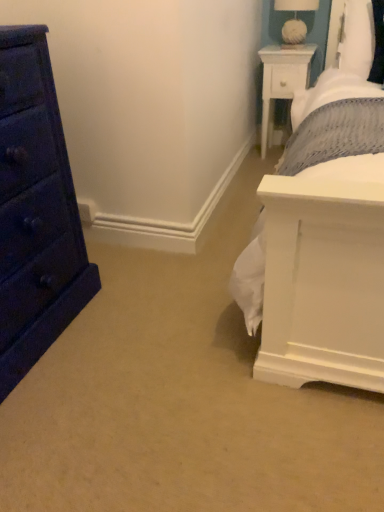
The height and width of the screenshot is (512, 384). Describe the element at coordinates (35, 210) in the screenshot. I see `matte dark blue dresser at left` at that location.

The image size is (384, 512). In order to click on white wood nightstand at upper right in this screenshot , I will do `click(282, 81)`.

Find the location of a particular element. white fabric-covered lampshade at upper right is located at coordinates (x=295, y=19).

Does white wood nightstand at upper right turn towards white fabric-covered lampshade at upper right?

No, white wood nightstand at upper right is not facing towards white fabric-covered lampshade at upper right.

Is white wood nightstand at upper right smaller than white fabric-covered lampshade at upper right?

No.

How distant is white wood nightstand at upper right from white fabric-covered lampshade at upper right?

They are 8.98 inches apart.

Based on the photo, considering the relative positions of white wood nightstand at upper right and white fabric-covered lampshade at upper right in the image provided, is white wood nightstand at upper right to the left or to the right of white fabric-covered lampshade at upper right?

Clearly, white wood nightstand at upper right is on the left of white fabric-covered lampshade at upper right in the image.

From a real-world perspective, is white fabric-covered lampshade at upper right located higher than matte dark blue dresser at left?

Correct, in the physical world, white fabric-covered lampshade at upper right is higher than matte dark blue dresser at left.

The height and width of the screenshot is (512, 384). I want to click on chest of drawers in front of the white fabric-covered lampshade at upper right, so click(x=35, y=210).

Does point (284, 39) lie in front of point (51, 139)?

That is False.

Does white fabric-covered lampshade at upper right come behind matte dark blue dresser at left?

Yes, it is.

How far apart are matte dark blue dresser at left and white wood nightstand at upper right?

They are 5.69 feet apart.

Is matte dark blue dresser at left far from white wood nightstand at upper right?

Yes, matte dark blue dresser at left and white wood nightstand at upper right are quite far apart.

From a real-world perspective, does matte dark blue dresser at left sit lower than white wood nightstand at upper right?

No.

How many degrees apart are the facing directions of matte dark blue dresser at left and white wood nightstand at upper right?

The angle between the facing direction of matte dark blue dresser at left and the facing direction of white wood nightstand at upper right is 88.5 degrees.

Is the depth of matte dark blue dresser at left greater than that of white fabric-covered lampshade at upper right?

No, matte dark blue dresser at left is in front of white fabric-covered lampshade at upper right.

Where is `table lamp lying above the matte dark blue dresser at left (from the image's perspective)`? This screenshot has height=512, width=384. table lamp lying above the matte dark blue dresser at left (from the image's perspective) is located at coordinates (x=295, y=19).

Which object is wider, white wood nightstand at upper right or matte dark blue dresser at left?

With larger width is matte dark blue dresser at left.

Locate an element on the screen. This screenshot has height=512, width=384. nightstand below the matte dark blue dresser at left (from a real-world perspective) is located at coordinates (282, 81).

Considering the positions of objects white wood nightstand at upper right and matte dark blue dresser at left in the image provided, who is in front, white wood nightstand at upper right or matte dark blue dresser at left?

Positioned in front is matte dark blue dresser at left.

Consider the image. Is white fabric-covered lampshade at upper right oriented away from white wood nightstand at upper right?

No, white fabric-covered lampshade at upper right's orientation is not away from white wood nightstand at upper right.

Is white fabric-covered lampshade at upper right wider or thinner than white wood nightstand at upper right?

Considering their sizes, white fabric-covered lampshade at upper right looks slimmer than white wood nightstand at upper right.

How distant is white fabric-covered lampshade at upper right from white wood nightstand at upper right?

8.98 inches.

The width and height of the screenshot is (384, 512). I want to click on table lamp on the right of white wood nightstand at upper right, so click(295, 19).

Find the location of a particular element. The height and width of the screenshot is (512, 384). table lamp behind the matte dark blue dresser at left is located at coordinates (295, 19).

Which object lies further to the anchor point white fabric-covered lampshade at upper right, white wood nightstand at upper right or matte dark blue dresser at left?

matte dark blue dresser at left.

Considering their positions, is white wood nightstand at upper right positioned further to matte dark blue dresser at left than white fabric-covered lampshade at upper right?

Among the two, white fabric-covered lampshade at upper right is located further to matte dark blue dresser at left.

Estimate the real-world distances between objects in this image. Which object is closer to white wood nightstand at upper right, matte dark blue dresser at left or white fabric-covered lampshade at upper right?

The object closer to white wood nightstand at upper right is white fabric-covered lampshade at upper right.

From the picture: From the image, which object appears to be nearer to white fabric-covered lampshade at upper right, matte dark blue dresser at left or white wood nightstand at upper right?

white wood nightstand at upper right is positioned closer to the anchor white fabric-covered lampshade at upper right.

Which object lies further to the anchor point matte dark blue dresser at left, white fabric-covered lampshade at upper right or white wood nightstand at upper right?

The object further to matte dark blue dresser at left is white fabric-covered lampshade at upper right.

Based on their spatial positions, is white fabric-covered lampshade at upper right or matte dark blue dresser at left further from white wood nightstand at upper right?

The object further to white wood nightstand at upper right is matte dark blue dresser at left.

At what (x,y) coordinates should I click in order to perform the action: click on table lamp located between matte dark blue dresser at left and white wood nightstand at upper right in the depth direction. Please return your answer as a coordinate pair (x, y). The height and width of the screenshot is (512, 384). Looking at the image, I should click on (295, 19).